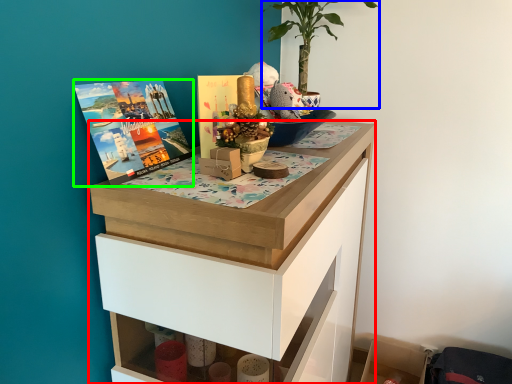
Question: Considering the real-world distances, which object is farthest from chest of drawers (highlighted by a red box)? houseplant (highlighted by a blue box) or book cover (highlighted by a green box)?

Choices:
 (A) houseplant
 (B) book cover

Answer: (A)